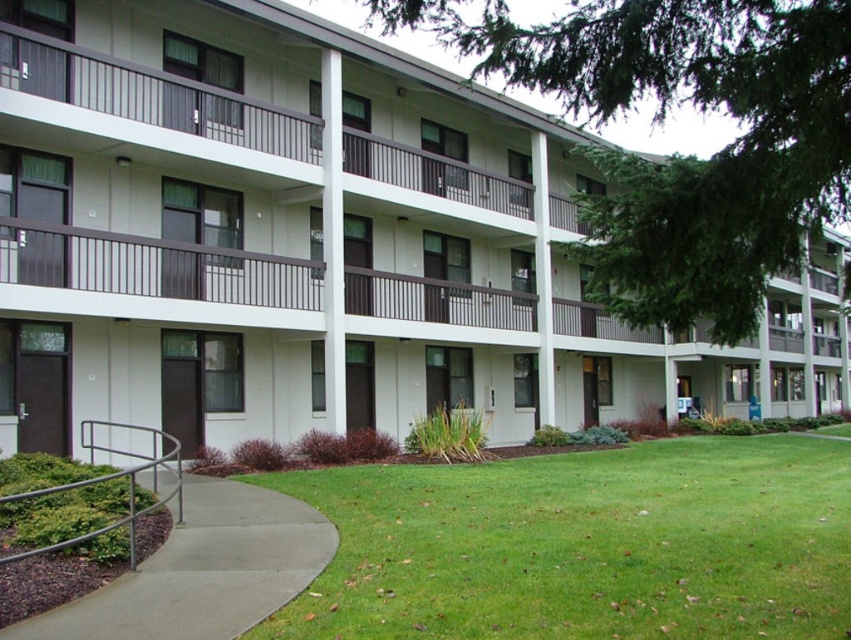
Looking at this image, does white matte building at center appear over concrete at lower left?

Yes, white matte building at center is above concrete at lower left.

Who is lower down, white matte building at center or concrete at lower left?

concrete at lower left

Who is more distant from viewer, [438,72] or [214,620]?

Point [438,72]

The height and width of the screenshot is (640, 851). Find the location of `white matte building at center`. white matte building at center is located at coordinates (318, 243).

Who is more distant from viewer, (784, 145) or (87, 620)?

Positioned behind is point (87, 620).

Locate an element on the screen. The width and height of the screenshot is (851, 640). green leafy tree at center is located at coordinates (683, 156).

Can you confirm if green grass at lower center is positioned to the right of green leafy tree at center?

In fact, green grass at lower center is to the left of green leafy tree at center.

Locate an element on the screen. green grass at lower center is located at coordinates (584, 545).

You are a GUI agent. You are given a task and a screenshot of the screen. Output one action in this format:
    pyautogui.click(x=<x>, y=<y>)
    Task: Click on the green grass at lower center
    Image resolution: width=851 pixels, height=640 pixels.
    Given the screenshot: What is the action you would take?
    pyautogui.click(x=584, y=545)